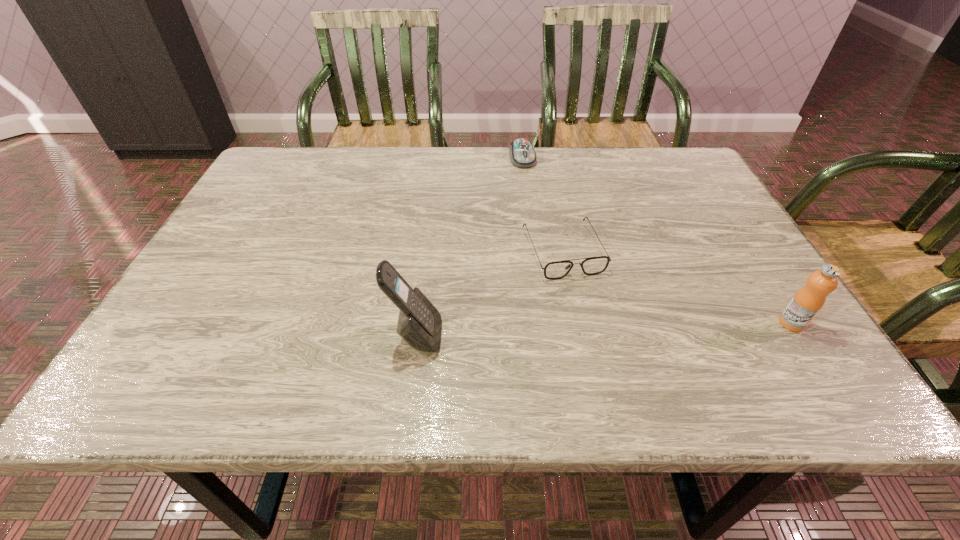
Locate an element on the screen. This screenshot has height=540, width=960. vacant point located on the wheel side of the shortest object is located at coordinates (532, 187).

Find the location of `vacant space located on the front-facing side of the third nearest object`. vacant space located on the front-facing side of the third nearest object is located at coordinates (597, 329).

This screenshot has width=960, height=540. What are the coordinates of `vacant position located on the front-facing side of the third nearest object` in the screenshot? It's located at (601, 337).

Where is `vacant space located on the front-facing side of the third nearest object`? The width and height of the screenshot is (960, 540). vacant space located on the front-facing side of the third nearest object is located at coordinates coord(588,309).

Where is `object positioned at the far edge`? object positioned at the far edge is located at coordinates coord(522,154).

At what (x,y) coordinates should I click in order to perform the action: click on cellular telephone that is at the near edge. Please return your answer as a coordinate pair (x, y). Looking at the image, I should click on (419, 324).

The height and width of the screenshot is (540, 960). I want to click on orange juice present at the near edge, so click(x=807, y=302).

Locate an element on the screen. Image resolution: width=960 pixels, height=540 pixels. object located in the right edge section of the desktop is located at coordinates (807, 302).

Find the location of a particular element. The width and height of the screenshot is (960, 540). object that is at the near right corner is located at coordinates (807, 302).

The image size is (960, 540). In the image, there is a desktop. Identify the location of free space at the far edge. (583, 150).